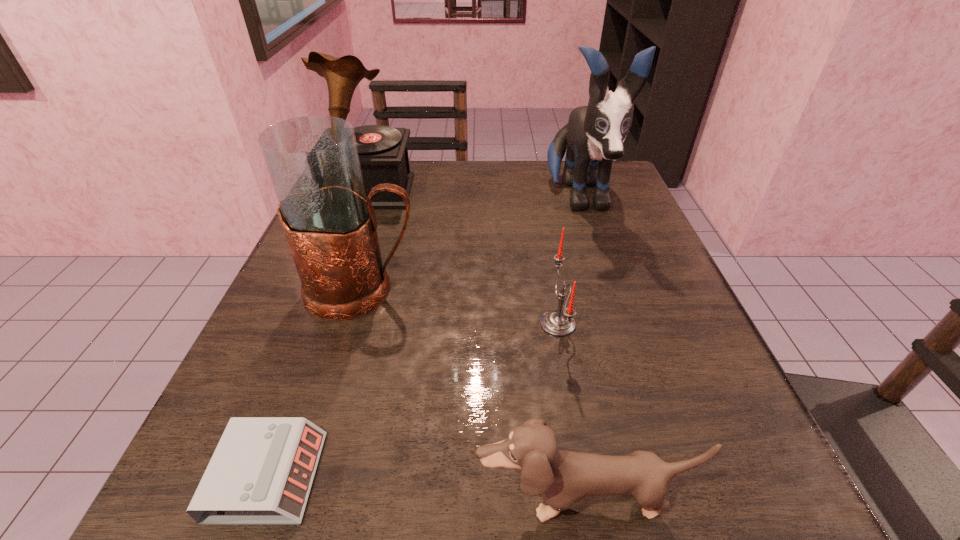
Identify the location of the taller puppy. (594, 135).

In order to click on phonograph_record in this screenshot , I will do `click(383, 153)`.

What are the coordinates of `pitcher` in the screenshot? It's located at (330, 225).

Locate an element on the screen. candle is located at coordinates click(559, 323).

Image resolution: width=960 pixels, height=540 pixels. I want to click on the nearer puppy, so click(x=561, y=477).

I want to click on alarm clock, so click(x=261, y=472).

The image size is (960, 540). Find the location of `free spot located on the front-facing side of the farther puppy`. free spot located on the front-facing side of the farther puppy is located at coordinates (616, 315).

At what (x,y) coordinates should I click in order to perform the action: click on vacant space situated 0.100m at the horn opening of the phonograph_record. Please return your answer as a coordinate pair (x, y). Looking at the image, I should click on (352, 236).

Identify the location of vacant space located 0.360m with the handle on the side of the pitcher. (621, 289).

Identify the location of free space located on the front-facing side of the candle. (345, 323).